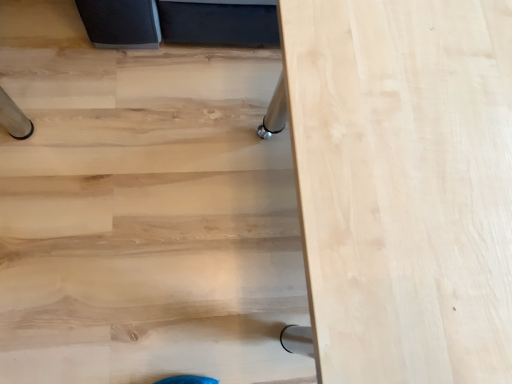
Find the location of a particular element. natural wood table at center is located at coordinates (404, 185).

The image size is (512, 384). What do you see at coordinates (404, 185) in the screenshot?
I see `natural wood table at center` at bounding box center [404, 185].

Describe the element at coordinates (147, 219) in the screenshot. The image size is (512, 384). I see `light wood table at lower right` at that location.

The image size is (512, 384). I want to click on light wood table at lower right, so click(147, 219).

Where is `natural wood table at center`? The height and width of the screenshot is (384, 512). natural wood table at center is located at coordinates (404, 185).

Considering the positions of objects natural wood table at center and light wood table at lower right in the image provided, who is more to the right, natural wood table at center or light wood table at lower right?

From the viewer's perspective, natural wood table at center appears more on the right side.

Is natural wood table at center closer to camera compared to light wood table at lower right?

That is True.

Is point (432, 94) closer to camera compared to point (300, 308)?

That is True.

From the image's perspective, which is above, natural wood table at center or light wood table at lower right?

From the image's view, light wood table at lower right is above.

From a real-world perspective, between natural wood table at center and light wood table at lower right, who is vertically higher?

natural wood table at center is physically above.

Considering the sizes of objects natural wood table at center and light wood table at lower right in the image provided, who is wider, natural wood table at center or light wood table at lower right?

Wider between the two is light wood table at lower right.

Considering the relative sizes of natural wood table at center and light wood table at lower right in the image provided, is natural wood table at center shorter than light wood table at lower right?

Incorrect, the height of natural wood table at center does not fall short of that of light wood table at lower right.

In terms of size, does natural wood table at center appear bigger or smaller than light wood table at lower right?

natural wood table at center is bigger than light wood table at lower right.

Would you say natural wood table at center contains light wood table at lower right?

No, light wood table at lower right is not surrounded by natural wood table at center.

Is natural wood table at center positioned far away from light wood table at lower right?

No, natural wood table at center is not far from light wood table at lower right.

Is natural wood table at center positioned with its back to light wood table at lower right?

No, natural wood table at center is not facing the opposite direction of light wood table at lower right.

Can you tell me how much natural wood table at center and light wood table at lower right differ in facing direction?

90.3 degrees.

I want to click on stairwell on the left of natural wood table at center, so click(x=147, y=219).

Does light wood table at lower right appear on the right side of natural wood table at center?

No.

Which object is further away from the camera, light wood table at lower right or natural wood table at center?

Positioned behind is light wood table at lower right.

Between point (78, 359) and point (369, 343), which one is positioned behind?

Point (78, 359)

From the image's perspective, relative to natural wood table at center, is light wood table at lower right above or below?

Clearly, from the image's perspective, light wood table at lower right is above natural wood table at center.

From a real-world perspective, which object rests below the other?

From a 3D spatial view, light wood table at lower right is below.

Is light wood table at lower right thinner than natural wood table at center?

No.

Between light wood table at lower right and natural wood table at center, which one has more height?

natural wood table at center.

Is light wood table at lower right smaller than natural wood table at center?

Yes, light wood table at lower right is smaller than natural wood table at center.

Is light wood table at lower right completely or partially outside of natural wood table at center?

Absolutely, light wood table at lower right is external to natural wood table at center.

Are light wood table at lower right and natural wood table at center making contact?

light wood table at lower right and natural wood table at center are clearly separated.

Is light wood table at lower right looking in the opposite direction of natural wood table at center?

No, light wood table at lower right's orientation is not away from natural wood table at center.

What's the angular difference between light wood table at lower right and natural wood table at center's facing directions?

90.3 degrees.

At what (x,y) coordinates should I click in order to perform the action: click on stairwell that appears above the natural wood table at center (from the image's perspective). Please return your answer as a coordinate pair (x, y). Looking at the image, I should click on (147, 219).

Locate an element on the screen. table below the light wood table at lower right (from the image's perspective) is located at coordinates (404, 185).

You are a GUI agent. You are given a task and a screenshot of the screen. Output one action in this format:
    pyautogui.click(x=<x>, y=<y>)
    Task: Click on the stairwell located underneath the natural wood table at center (from a real-world perspective)
    The width and height of the screenshot is (512, 384).
    Given the screenshot: What is the action you would take?
    pyautogui.click(x=147, y=219)